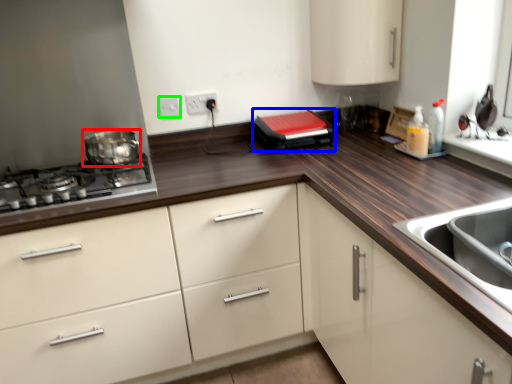
Question: Considering the real-world distances, which object is closest to home appliance (highlighted by a red box)? kitchen appliance (highlighted by a blue box) or electric outlet (highlighted by a green box).

Choices:
 (A) kitchen appliance
 (B) electric outlet

Answer: (B)